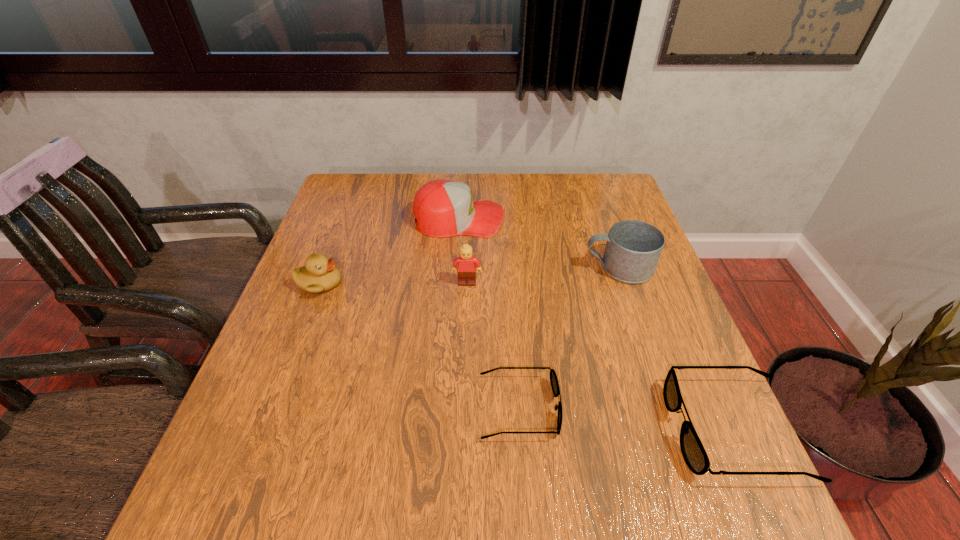
This screenshot has width=960, height=540. Identify the location of vacant area between the shortest object and the baseball cap. (489, 313).

I want to click on vacant region between the shortest object and the duckling, so click(420, 346).

In order to click on free space between the mug and the Lego in this screenshot , I will do `click(542, 275)`.

Find the location of a particular element. The height and width of the screenshot is (540, 960). free space between the second shortest object and the leftmost object is located at coordinates (526, 356).

What are the coordinates of `vacant point located between the Lego and the shorter spectacles` in the screenshot? It's located at (493, 346).

This screenshot has width=960, height=540. In order to click on free space that is in between the farthest object and the leftmost object in this screenshot , I will do `click(389, 251)`.

In order to click on vacant point located between the taller spectacles and the farthest object in this screenshot , I will do `click(596, 324)`.

At what (x,y) coordinates should I click in order to perform the action: click on object that is the second closest to the Lego. Please return your answer as a coordinate pair (x, y). Looking at the image, I should click on (553, 377).

Where is `object that stands as the second closest to the taller spectacles`? Image resolution: width=960 pixels, height=540 pixels. object that stands as the second closest to the taller spectacles is located at coordinates (633, 248).

Where is `free space that satisfies the following two spatial constraints: 1. on the side of the mug with the handle; 2. on the face of the Lego`? The image size is (960, 540). free space that satisfies the following two spatial constraints: 1. on the side of the mug with the handle; 2. on the face of the Lego is located at coordinates 624,283.